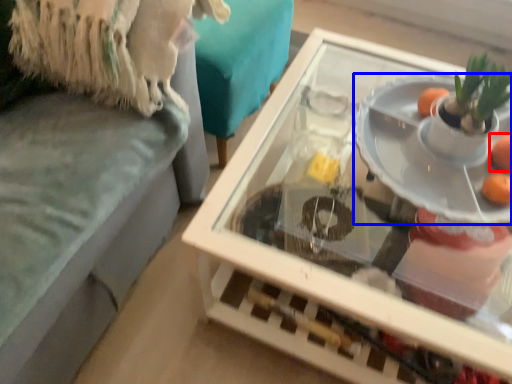
Question: Which of the following is the closest to the observer, orange (highlighted by a red box) or plate (highlighted by a blue box)?

Choices:
 (A) orange
 (B) plate

Answer: (B)